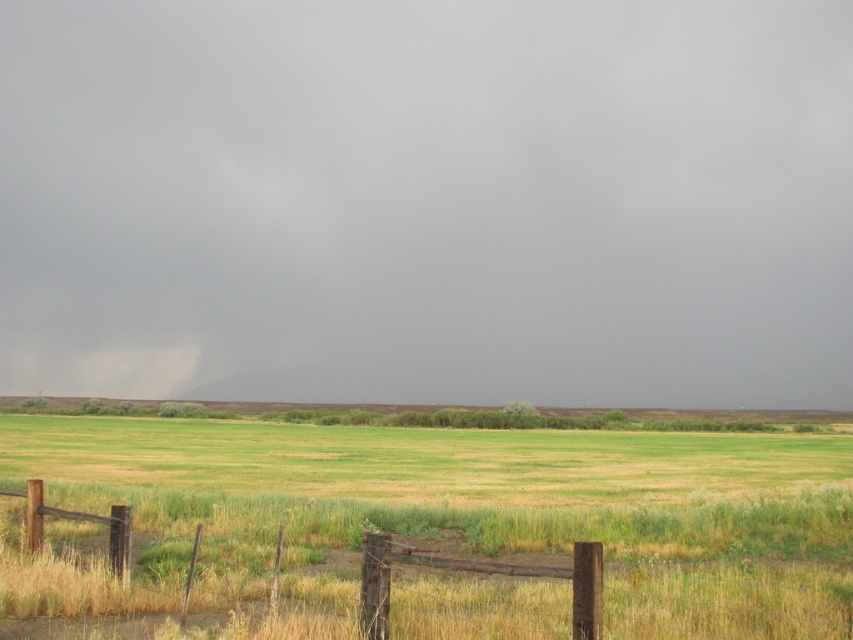
Question: Which point appears closest to the camera in this image?

Choices:
 (A) 264,632
 (B) 103,381
 (C) 160,3

Answer: (A)

Question: Which point is closer to the camera?

Choices:
 (A) wooden fence at lower center
 (B) gray cotton cloud at upper left

Answer: (A)

Question: Is dark gray cloud at center positioned at the back of wooden fence at lower center?

Choices:
 (A) yes
 (B) no

Answer: (A)

Question: Does wooden fence at lower center have a lesser width compared to gray cotton cloud at upper left?

Choices:
 (A) yes
 (B) no

Answer: (A)

Question: Can you confirm if dark gray cloud at center is wider than wooden fence at lower center?

Choices:
 (A) no
 (B) yes

Answer: (B)

Question: Which object is the closest to the gray cotton cloud at upper left?

Choices:
 (A) wooden fence at lower center
 (B) dark gray cloud at center

Answer: (B)